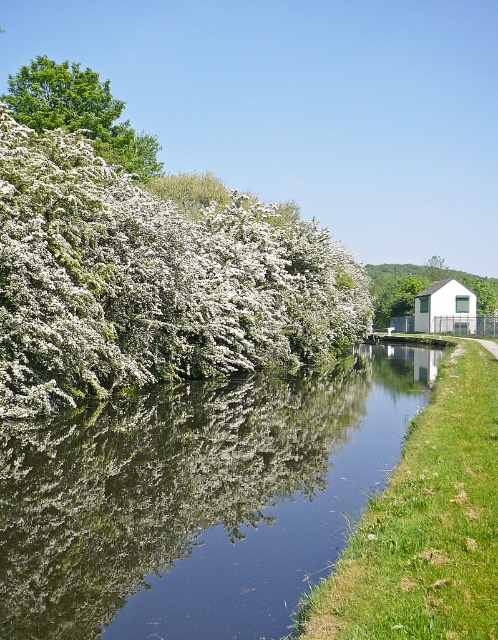
Question: Which point is farther to the camera?

Choices:
 (A) (368, 266)
 (B) (61, 84)
 (C) (95, 243)
 (D) (29, 580)

Answer: (A)

Question: Which object is positioned closest to the green reflective water at center?

Choices:
 (A) white matte house at right
 (B) white matte house at upper right
 (C) white fluffy bush at left

Answer: (C)

Question: Is green leafy tree at upper left wider than white matte house at upper right?

Choices:
 (A) yes
 (B) no

Answer: (B)

Question: Does green reflective water at center appear on the left side of white matte house at upper right?

Choices:
 (A) no
 (B) yes

Answer: (B)

Question: Which of these objects is positioned farthest from the white fluffy bush at left?

Choices:
 (A) green leafy tree at upper left
 (B) white matte house at upper right
 (C) green reflective water at center
 (D) white matte house at right

Answer: (B)

Question: Does green reflective water at center have a smaller size compared to green leafy tree at upper left?

Choices:
 (A) yes
 (B) no

Answer: (A)